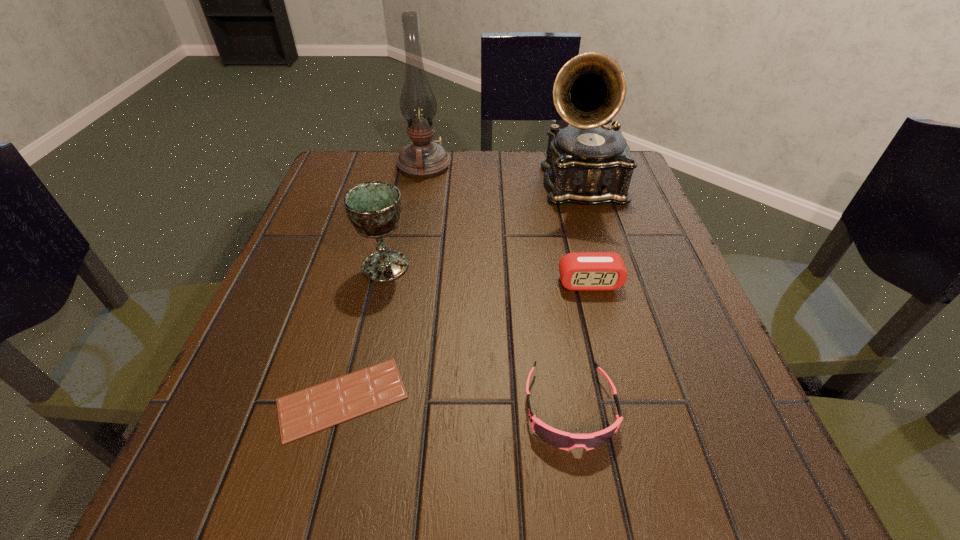
This screenshot has height=540, width=960. I want to click on alarm clock that is at the right edge, so click(x=581, y=270).

Identify the location of object at the far left corner. (423, 158).

Locate an element on the screen. The image size is (960, 540). object present at the near left corner is located at coordinates (318, 407).

Where is `object situated at the far right corner`? object situated at the far right corner is located at coordinates (589, 163).

Where is `vacant space at the far edge of the desktop`? vacant space at the far edge of the desktop is located at coordinates (501, 161).

The height and width of the screenshot is (540, 960). I want to click on vacant area at the near edge, so click(409, 505).

At what (x,y) coordinates should I click in order to perform the action: click on vacant space at the left edge of the desktop. Please return your answer as a coordinate pair (x, y). Looking at the image, I should click on (294, 238).

In the image, there is a desktop. Identify the location of free space at the right edge. (619, 328).

In the image, there is a desktop. Where is `vacant space at the far left corner`? This screenshot has width=960, height=540. vacant space at the far left corner is located at coordinates [x=348, y=184].

Where is `vacant space at the far right corner of the desktop`? The image size is (960, 540). vacant space at the far right corner of the desktop is located at coordinates [629, 206].